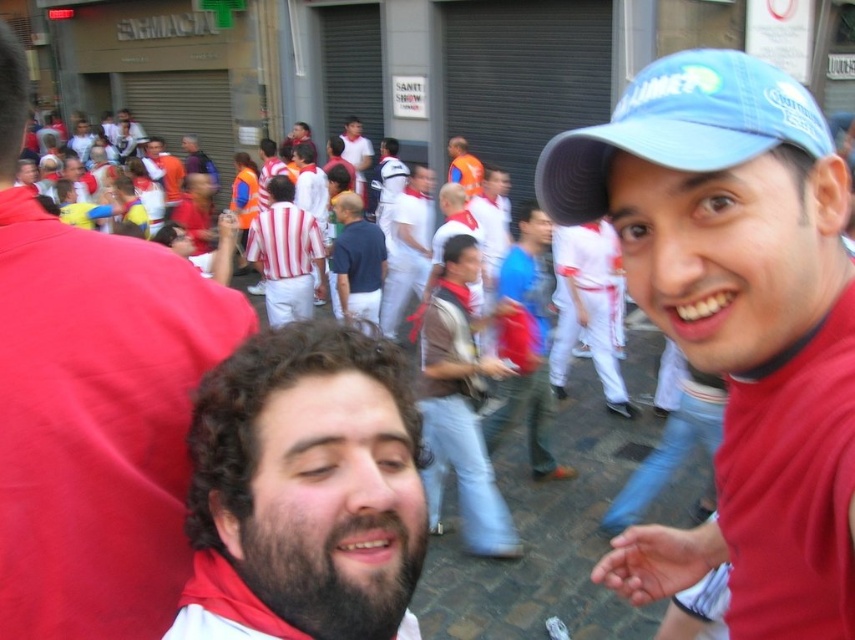
From the picture: You are standing at the center of the street and see two points in the image. The first point is at coordinate point (675, 58) and the second is at point (352, 276). Which point is closer to you?

Point (675, 58) is in front of point (352, 276), so it is closer to you.

You are a photographer trying to capture the scene. You notice the curly hair at center and the orange reflective vest at center. Which object is located to the left of the other?

The curly hair at center is positioned on the left side of orange reflective vest at center.

You are a photographer trying to capture a group photo of the curly hair at center and the orange reflective vest at center. Based on their sizes in the image, which object should you place closer to the camera to ensure both appear equally sized in the photo?

The curly hair at center has a lesser width compared to the orange reflective vest at center. To make them appear equally sized, you should place the curly hair at center closer to the camera since it is smaller in width and needs to be magnified to match the size of the orange reflective vest at center.